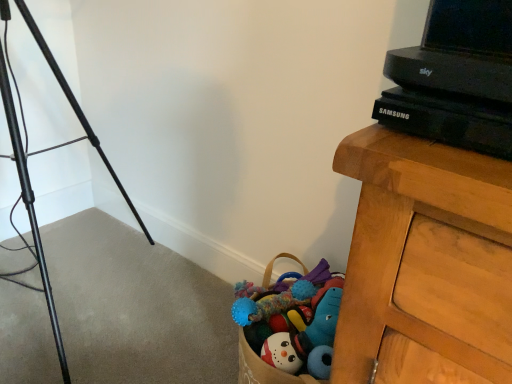
Question: Is black metal tripod at left inside or outside of black plastic tv at upper right?

Choices:
 (A) outside
 (B) inside

Answer: (A)

Question: Is black metal tripod at left taller or shorter than black plastic tv at upper right?

Choices:
 (A) short
 (B) tall

Answer: (B)

Question: Looking at their shapes, would you say black metal tripod at left is wider or thinner than black plastic tv at upper right?

Choices:
 (A) wide
 (B) thin

Answer: (A)

Question: Choose the correct answer: Is black plastic tv at upper right inside black metal tripod at left or outside it?

Choices:
 (A) outside
 (B) inside

Answer: (A)

Question: From the image's perspective, is black plastic tv at upper right positioned above or below black metal tripod at left?

Choices:
 (A) above
 (B) below

Answer: (A)

Question: Relative to black metal tripod at left, is black plastic tv at upper right in front or behind?

Choices:
 (A) front
 (B) behind

Answer: (A)

Question: Is black plastic tv at upper right wider or thinner than black metal tripod at left?

Choices:
 (A) thin
 (B) wide

Answer: (A)